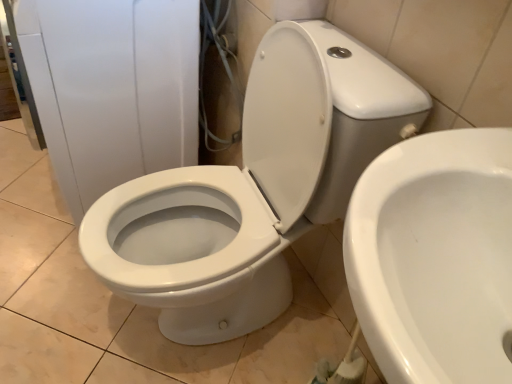
Question: Does white glossy toilet at center, the first toilet viewed from the right, have a lesser height compared to white glossy toilet at center, which is the 2th toilet from right to left?

Choices:
 (A) no
 (B) yes

Answer: (B)

Question: From a real-world perspective, is white glossy toilet at center, the first toilet viewed from the right, physically below white glossy toilet at center, which is the 2th toilet from right to left?

Choices:
 (A) no
 (B) yes

Answer: (A)

Question: Is white glossy toilet at center, which ranks as the second toilet in left-to-right order, not close to white glossy toilet at center, which is the 2th toilet from right to left?

Choices:
 (A) yes
 (B) no

Answer: (B)

Question: Can you confirm if white glossy toilet at center, the first toilet viewed from the right, is thinner than white glossy toilet at center, arranged as the first toilet when viewed from the left?

Choices:
 (A) yes
 (B) no

Answer: (A)

Question: Does white glossy toilet at center, the first toilet viewed from the right, have a smaller size compared to white glossy toilet at center, arranged as the first toilet when viewed from the left?

Choices:
 (A) yes
 (B) no

Answer: (A)

Question: Would you say white glossy toilet at center, which ranks as the second toilet in left-to-right order, is to the left or to the right of white glossy toilet at center, arranged as the first toilet when viewed from the left, in the picture?

Choices:
 (A) right
 (B) left

Answer: (A)

Question: In terms of size, does white glossy toilet at center, the first toilet viewed from the right, appear bigger or smaller than white glossy toilet at center, which is the 2th toilet from right to left?

Choices:
 (A) big
 (B) small

Answer: (B)

Question: From a real-world perspective, relative to white glossy toilet at center, which is the 2th toilet from right to left, is white glossy toilet at center, the first toilet viewed from the right, vertically above or below?

Choices:
 (A) above
 (B) below

Answer: (A)

Question: Does point (368, 281) appear closer or farther from the camera than point (333, 185)?

Choices:
 (A) closer
 (B) farther

Answer: (A)

Question: In terms of width, does white glossy toilet at center, arranged as the first toilet when viewed from the left, look wider or thinner when compared to white glossy toilet at center?

Choices:
 (A) wide
 (B) thin

Answer: (A)

Question: Looking at the image, does white glossy toilet at center, arranged as the first toilet when viewed from the left, seem bigger or smaller compared to white glossy toilet at center?

Choices:
 (A) big
 (B) small

Answer: (B)

Question: From a real-world perspective, is white glossy toilet at center, which is the 2th toilet from right to left, physically located above or below white glossy toilet at center?

Choices:
 (A) above
 (B) below

Answer: (A)

Question: Choose the correct answer: Is white glossy toilet at center, arranged as the first toilet when viewed from the left, inside white glossy toilet at center or outside it?

Choices:
 (A) outside
 (B) inside

Answer: (A)

Question: Relative to white glossy toilet at center, the first toilet viewed from the right, is white glossy toilet at center, arranged as the first toilet when viewed from the left, in front or behind?

Choices:
 (A) behind
 (B) front

Answer: (A)

Question: Does point (105, 218) appear closer or farther from the camera than point (394, 157)?

Choices:
 (A) farther
 (B) closer

Answer: (A)